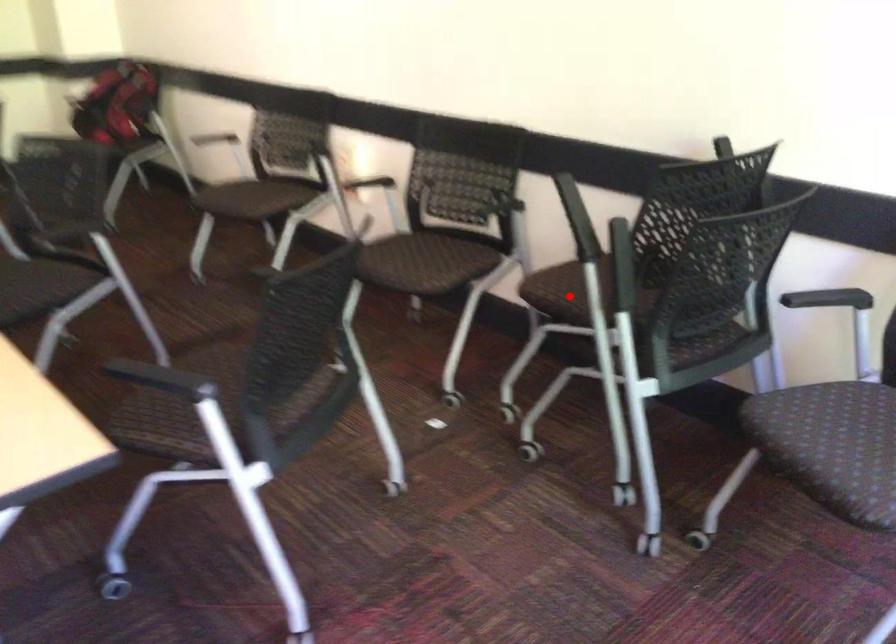
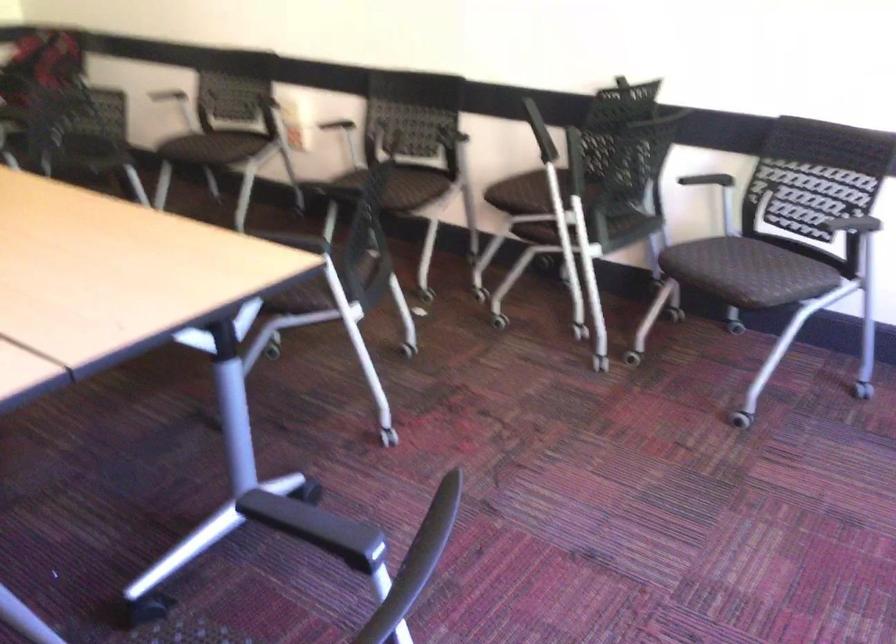
Where in the second image is the point corresponding to the highlighted location from the first image?

(526, 193)